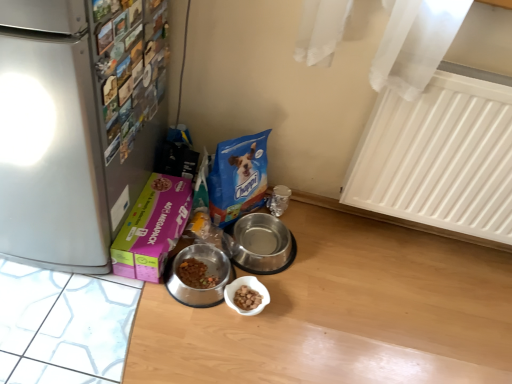
Question: Considering their positions, is white plastic radiator at upper right located in front of or behind metallic stainless steel bowl at center, arranged as the 2th appliance when viewed from the right?

Choices:
 (A) front
 (B) behind

Answer: (A)

Question: In terms of width, does white plastic radiator at upper right look wider or thinner when compared to metallic stainless steel bowl at center, arranged as the 2th appliance when viewed from the right?

Choices:
 (A) thin
 (B) wide

Answer: (A)

Question: Which is nearer to the satin silver refrigerator at left?

Choices:
 (A) pink cardboard box at lower left
 (B) white plastic radiator at upper right
 (C) silver metallic bowl at center, the 2th appliance from the left
 (D) metallic stainless steel bowl at center, arranged as the 2th appliance when viewed from the right

Answer: (A)

Question: Estimate the real-world distances between objects in this image. Which object is closer to the silver metallic bowl at center, acting as the first appliance starting from the right?

Choices:
 (A) satin silver refrigerator at left
 (B) metallic stainless steel bowl at center, arranged as the 2th appliance when viewed from the right
 (C) white plastic radiator at upper right
 (D) pink cardboard box at lower left

Answer: (B)